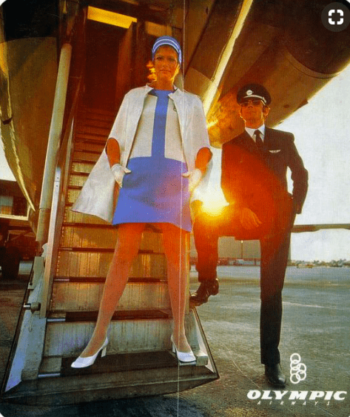
I want to click on stairs, so click(x=85, y=265).